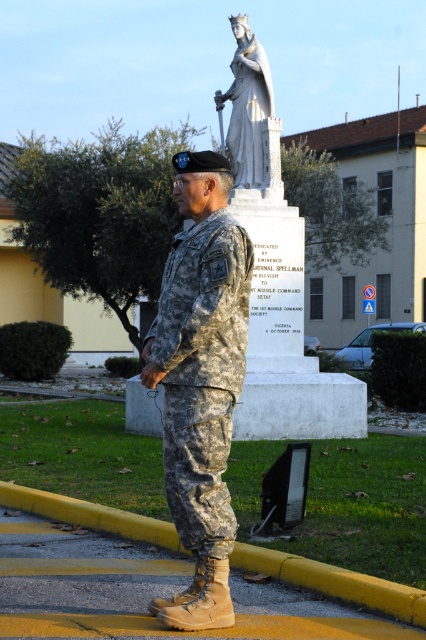
Who is lower down, camouflage uniform at center or white marble statue at upper center?

camouflage uniform at center is lower down.

In order to click on camouflage uniform at center in this screenshot , I will do `click(201, 380)`.